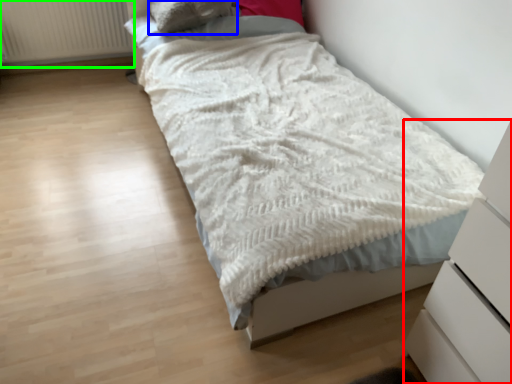
Question: Considering the real-world distances, which object is farthest from chest of drawers (highlighted by a red box)? pillow (highlighted by a blue box) or radiator (highlighted by a green box)?

Choices:
 (A) pillow
 (B) radiator

Answer: (B)